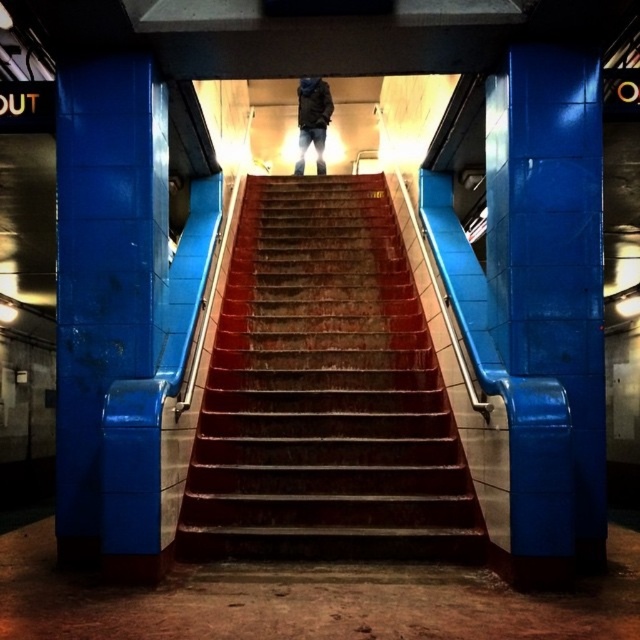
You are standing at the bottom of the stairs in the subway station. You see a point marked at coordinates (324, 394). What object is located at that point?

The point at coordinates (324, 394) indicates rusty metal stairs at center.